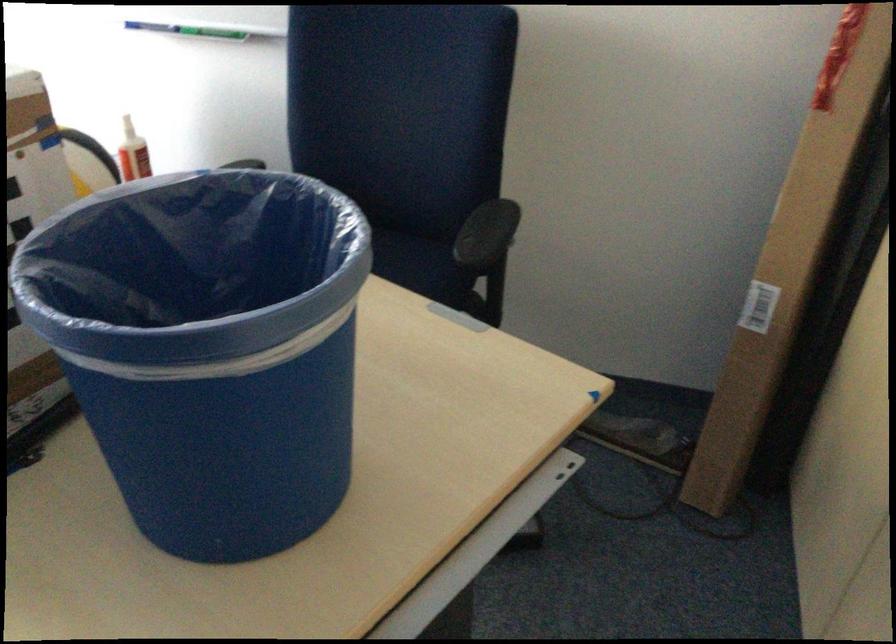
This screenshot has width=896, height=644. Identify the location of white and red bottle. (133, 153).